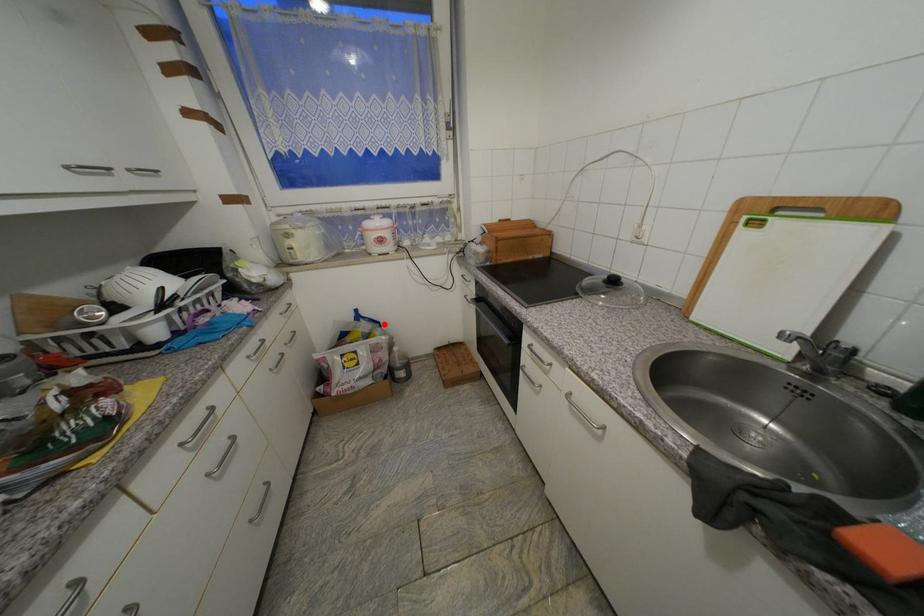
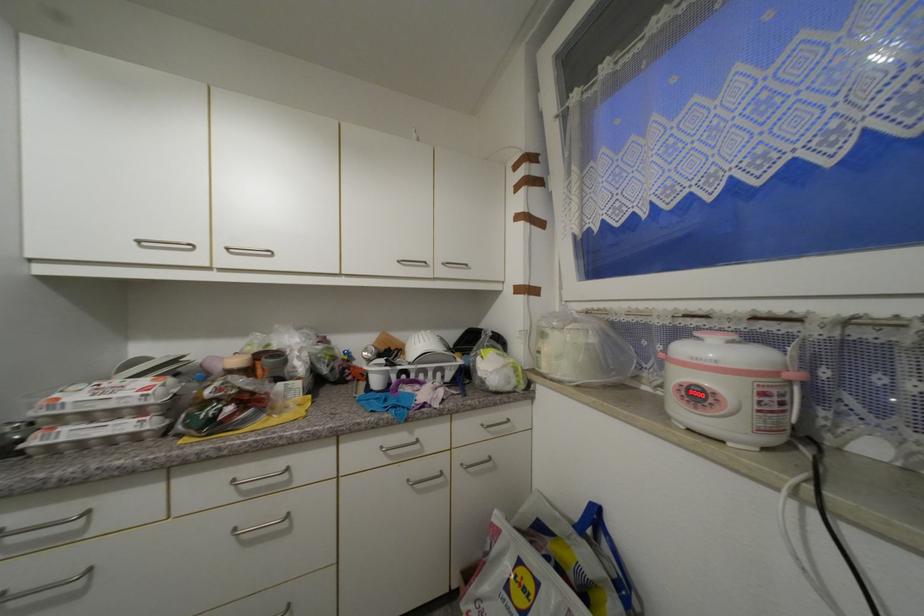
Find the pixel in the second image that matches the highlighted location in the first image.

(636, 588)